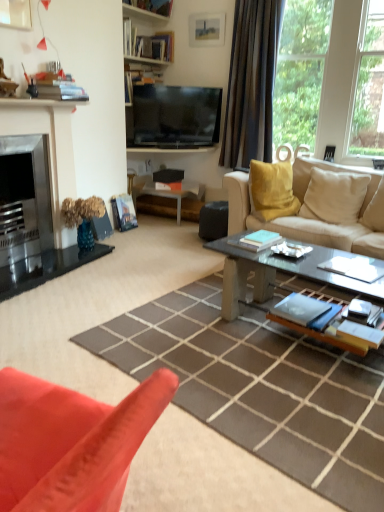
Describe the element at coordinates (319, 208) in the screenshot. Image resolution: width=384 pixels, height=512 pixels. I see `beige fabric couch at center` at that location.

Describe the element at coordinates (31, 219) in the screenshot. I see `brushed metal fireplace at left` at that location.

Measure the distance between point (x=138, y=103) and camera.

Point (x=138, y=103) is 4.23 meters from camera.

The width and height of the screenshot is (384, 512). I want to click on flat screen tv at center, so click(176, 116).

Locate an element on the screen. Image resolution: width=384 pixels, height=512 pixels. matte white picture frame at upper center is located at coordinates (206, 29).

This screenshot has width=384, height=512. What are the coordinates of `beige fabric couch at center` in the screenshot? It's located at (319, 208).

From a real-world perspective, between beige fabric couch at center and wooden bookshelf at upper center, who is vertically higher?

In real-world perspective, wooden bookshelf at upper center is above.

Which is less distant, (381, 252) or (150, 0)?

Point (381, 252)

From the picture: From the image's perspective, which is below, beige fabric couch at center or wooden bookshelf at upper center?

beige fabric couch at center.

Is beige fabric couch at center shorter than wooden bookshelf at upper center?

No.

Is point (340, 199) closer to viewer compared to point (265, 260)?

No, (340, 199) is further to viewer.

Is beige fabric pillow at right thinner than glass concrete coffee table at center?

Indeed, beige fabric pillow at right has a lesser width compared to glass concrete coffee table at center.

Is beige fabric pillow at right positioned with its back to glass concrete coffee table at center?

No, beige fabric pillow at right is not facing away from glass concrete coffee table at center.

I want to click on shelf in front of the matte white picture frame at upper center, so click(149, 8).

Is matte white picture frame at upper center oriented towards wooden bookshelf at upper center?

No.

From a real-world perspective, is matte white picture frame at upper center on wooden bookshelf at upper center?

No, from a real-world perspective, matte white picture frame at upper center is not over wooden bookshelf at upper center

From their relative heights in the image, would you say matte white picture frame at upper center is taller or shorter than wooden bookshelf at upper center?

Clearly, matte white picture frame at upper center is taller compared to wooden bookshelf at upper center.

Is glass concrete coffee table at center next to beige fabric couch at center?

No, glass concrete coffee table at center is not making contact with beige fabric couch at center.

From a real-world perspective, is glass concrete coffee table at center positioned above or below beige fabric couch at center?

glass concrete coffee table at center is situated lower than beige fabric couch at center in the real world.

Which object is closer to the camera, glass concrete coffee table at center or beige fabric couch at center?

glass concrete coffee table at center is more forward.

Which object is positioned more to the left, glass concrete coffee table at center or beige fabric couch at center?

From the viewer's perspective, glass concrete coffee table at center appears more on the left side.

Is glass concrete coffee table at center in contact with flat screen tv at center?

No, glass concrete coffee table at center is not beside flat screen tv at center.

Which object is wider, glass concrete coffee table at center or flat screen tv at center?

glass concrete coffee table at center.

Which object is further away from the camera, glass concrete coffee table at center or flat screen tv at center?

flat screen tv at center.

Does beige fabric pillow at right lie in front of flat screen tv at center?

Yes, it is.

Is beige fabric pillow at right with flat screen tv at center?

No, beige fabric pillow at right is not next to flat screen tv at center.

Identify the location of television on the left of beige fabric pillow at right. (176, 116).

Is matte white picture frame at upper center positioned beyond the bounds of white glossy side table at center?

matte white picture frame at upper center is positioned outside white glossy side table at center.

From a real-world perspective, is matte white picture frame at upper center on white glossy side table at center?

Yes, from a real-world perspective, matte white picture frame at upper center is over white glossy side table at center

Is matte white picture frame at upper center not near white glossy side table at center?

Yes, matte white picture frame at upper center is far from white glossy side table at center.

Could you tell me if matte white picture frame at upper center is facing white glossy side table at center?

No, matte white picture frame at upper center is not turned towards white glossy side table at center.

Where is `studio couch that is below the wooden bookshelf at upper center (from the image's perspective)`? This screenshot has height=512, width=384. studio couch that is below the wooden bookshelf at upper center (from the image's perspective) is located at coordinates (319, 208).

Image resolution: width=384 pixels, height=512 pixels. Identify the location of coffee table in front of the beige fabric pillow at right. (275, 273).

Considering their positions, is glass concrete coffee table at center positioned further to wooden bookshelf at upper center than brown fabric curtain at right?

glass concrete coffee table at center is further to wooden bookshelf at upper center.

Estimate the real-world distances between objects in this image. Which object is further from matte white picture frame at upper center, glass concrete coffee table at center or flat screen tv at center?

The object further to matte white picture frame at upper center is glass concrete coffee table at center.

Considering their positions, is wooden bookshelf at upper center positioned further to matte white picture frame at upper center than beige fabric pillow at right?

beige fabric pillow at right.

Based on their spatial positions, is glass concrete coffee table at center or flat screen tv at center further from brushed metal fireplace at left?

Based on the image, flat screen tv at center appears to be further to brushed metal fireplace at left.

Estimate the real-world distances between objects in this image. Which object is closer to beige fabric couch at center, white glossy side table at center or glass concrete coffee table at center?

glass concrete coffee table at center is closer to beige fabric couch at center.

When comparing their distances from matte white picture frame at upper center, does beige fabric pillow at right or flat screen tv at center seem closer?

flat screen tv at center.

Based on their spatial positions, is white glossy side table at center or brown fabric curtain at right further from brushed metal fireplace at left?

brown fabric curtain at right lies further to brushed metal fireplace at left than the other object.

From the image, which object appears to be nearer to flat screen tv at center, beige fabric pillow at right or brown fabric curtain at right?

Among the two, brown fabric curtain at right is located nearer to flat screen tv at center.

The image size is (384, 512). Find the location of `curtain between beige fabric couch at center and flat screen tv at center along the z-axis`. curtain between beige fabric couch at center and flat screen tv at center along the z-axis is located at coordinates (251, 83).

This screenshot has height=512, width=384. Find the location of `television between glass concrete coffee table at center and matte white picture frame at upper center from front to back`. television between glass concrete coffee table at center and matte white picture frame at upper center from front to back is located at coordinates (176, 116).

Find the location of a particular element. television between wooden bookshelf at upper center and glass concrete coffee table at center vertically is located at coordinates (176, 116).

I want to click on curtain that lies between matte white picture frame at upper center and beige fabric couch at center from top to bottom, so [251, 83].